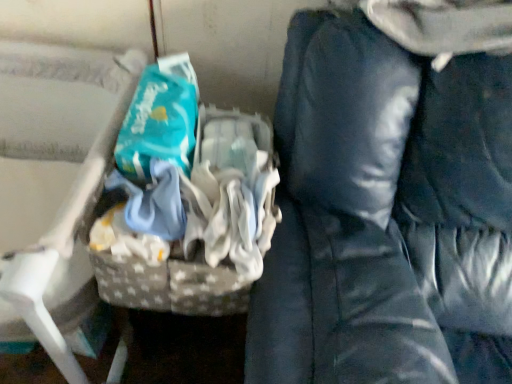
Question: Is gray fabric basket at left smaller than dark blue fabric bean bag chair at right?

Choices:
 (A) yes
 (B) no

Answer: (A)

Question: Can you confirm if gray fabric basket at left is shorter than dark blue fabric bean bag chair at right?

Choices:
 (A) no
 (B) yes

Answer: (B)

Question: Can you confirm if gray fabric basket at left is bigger than dark blue fabric bean bag chair at right?

Choices:
 (A) no
 (B) yes

Answer: (A)

Question: Can you confirm if gray fabric basket at left is positioned to the left of dark blue fabric bean bag chair at right?

Choices:
 (A) yes
 (B) no

Answer: (A)

Question: Is the surface of gray fabric basket at left in direct contact with dark blue fabric bean bag chair at right?

Choices:
 (A) yes
 (B) no

Answer: (B)

Question: Considering the relative sizes of gray fabric basket at left and dark blue fabric bean bag chair at right in the image provided, is gray fabric basket at left wider than dark blue fabric bean bag chair at right?

Choices:
 (A) no
 (B) yes

Answer: (A)

Question: Does dark blue fabric bean bag chair at right come in front of teal fabric wipes at center?

Choices:
 (A) yes
 (B) no

Answer: (A)

Question: Is dark blue fabric bean bag chair at right turned away from teal fabric wipes at center?

Choices:
 (A) no
 (B) yes

Answer: (A)

Question: Is dark blue fabric bean bag chair at right positioned far away from teal fabric wipes at center?

Choices:
 (A) no
 (B) yes

Answer: (A)

Question: From a real-world perspective, is dark blue fabric bean bag chair at right on top of teal fabric wipes at center?

Choices:
 (A) no
 (B) yes

Answer: (A)

Question: Would you say teal fabric wipes at center is part of dark blue fabric bean bag chair at right's contents?

Choices:
 (A) yes
 (B) no

Answer: (B)

Question: From the image's perspective, is dark blue fabric bean bag chair at right located beneath teal fabric wipes at center?

Choices:
 (A) yes
 (B) no

Answer: (A)

Question: Is teal fabric wipes at center further to the viewer compared to gray fabric basket at left?

Choices:
 (A) no
 (B) yes

Answer: (B)